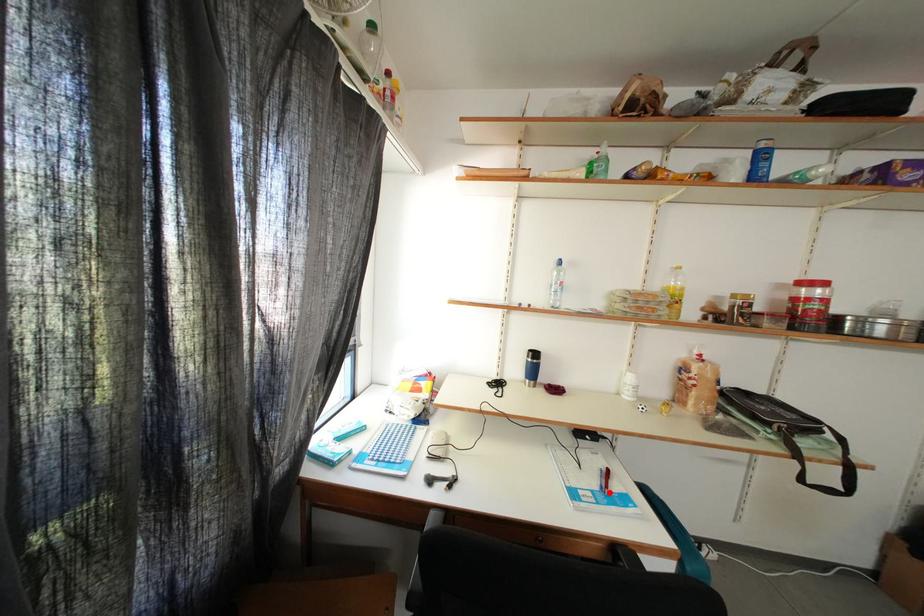
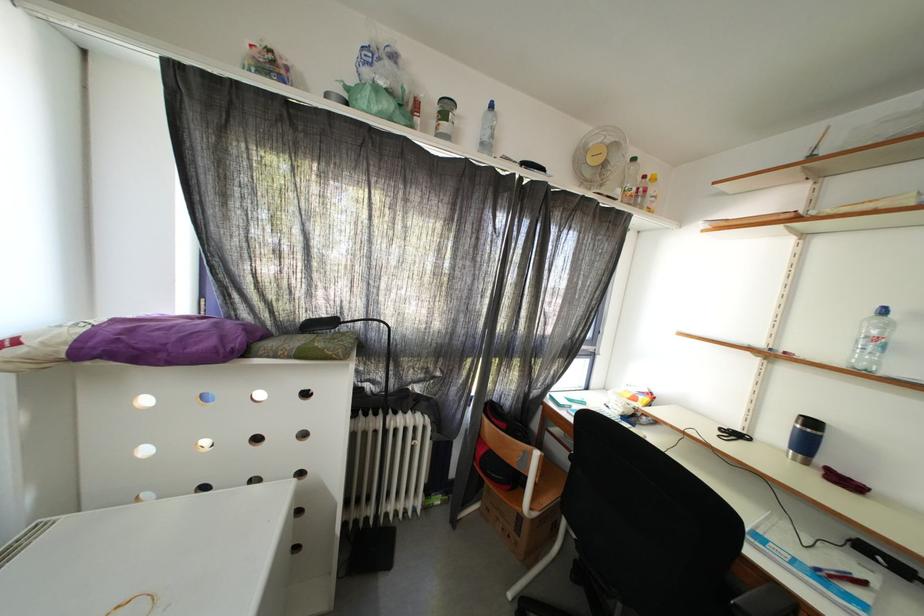
Locate, in the second image, the point that corresponds to the highlighted location in the first image.

(827, 573)